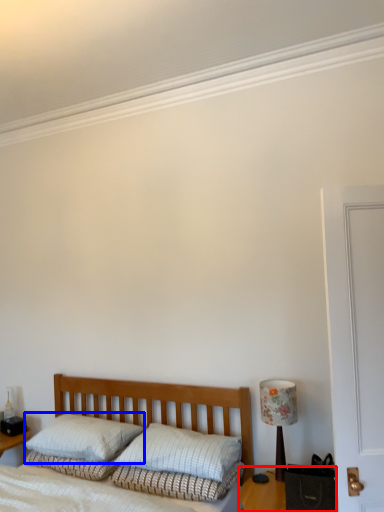
Question: Which point is further to the camera, table (highlighted by a red box) or pillow (highlighted by a blue box)?

Choices:
 (A) table
 (B) pillow

Answer: (B)